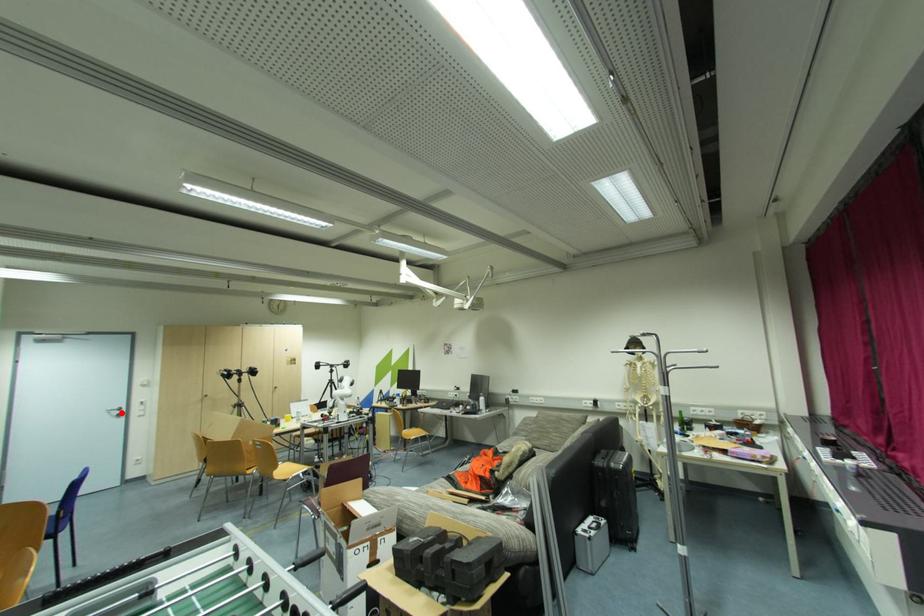
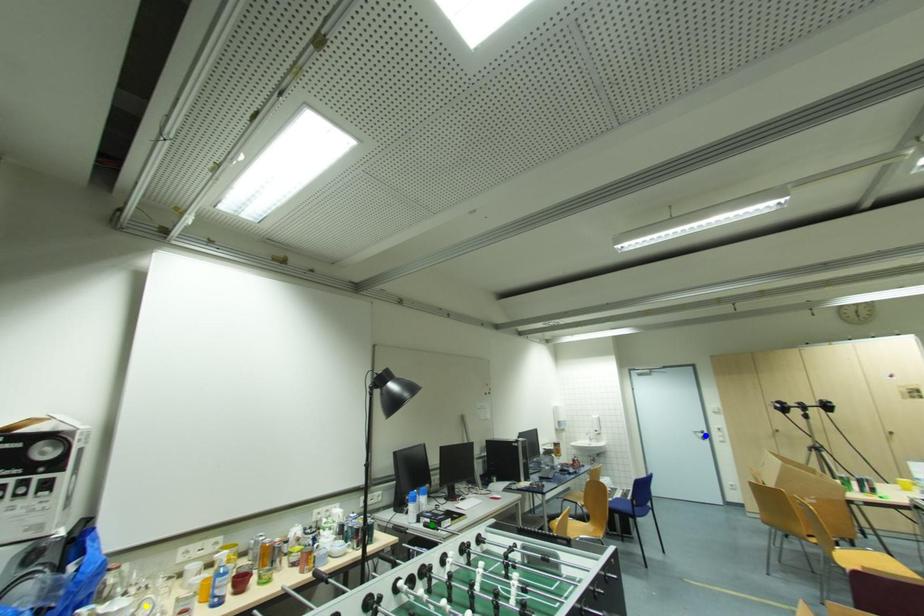
Question: I am providing you with two images of the same scene from different viewpoints. A red point is marked on the first image. You are given multiple points on the second image. In image 2, which mark is for the same physical point as the one in image 1?

Choices:
 (A) blue point
 (B) green point
 (C) yellow point

Answer: (A)